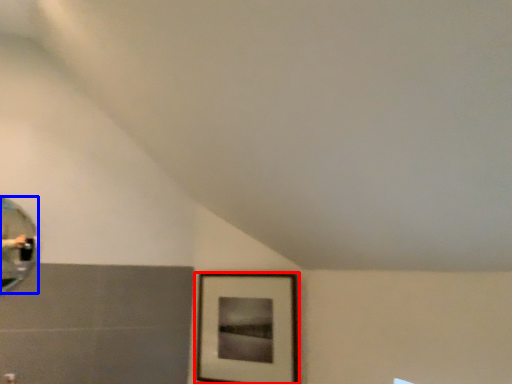
Question: Among these objects, which one is farthest to the camera, picture frame (highlighted by a red box) or mirror (highlighted by a blue box)?

Choices:
 (A) picture frame
 (B) mirror

Answer: (A)